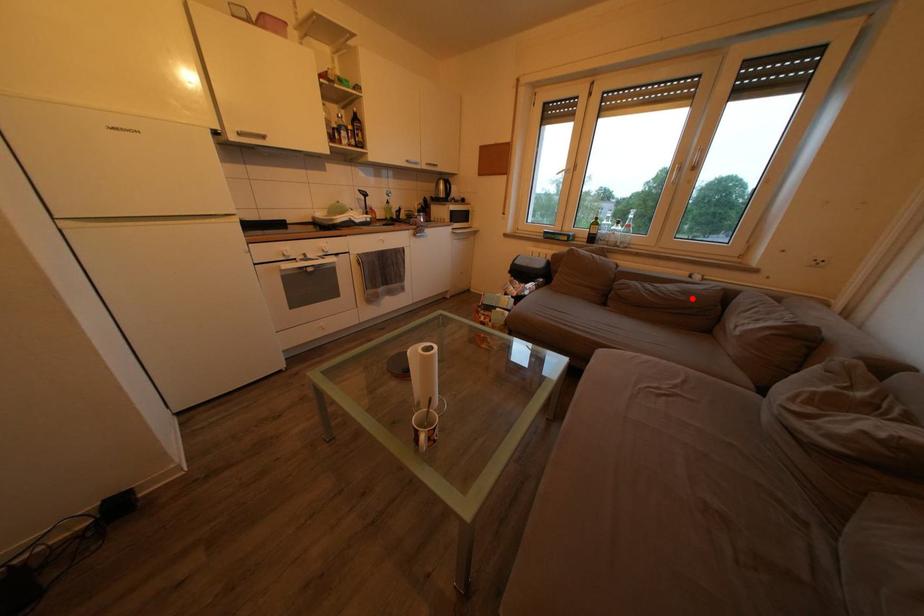
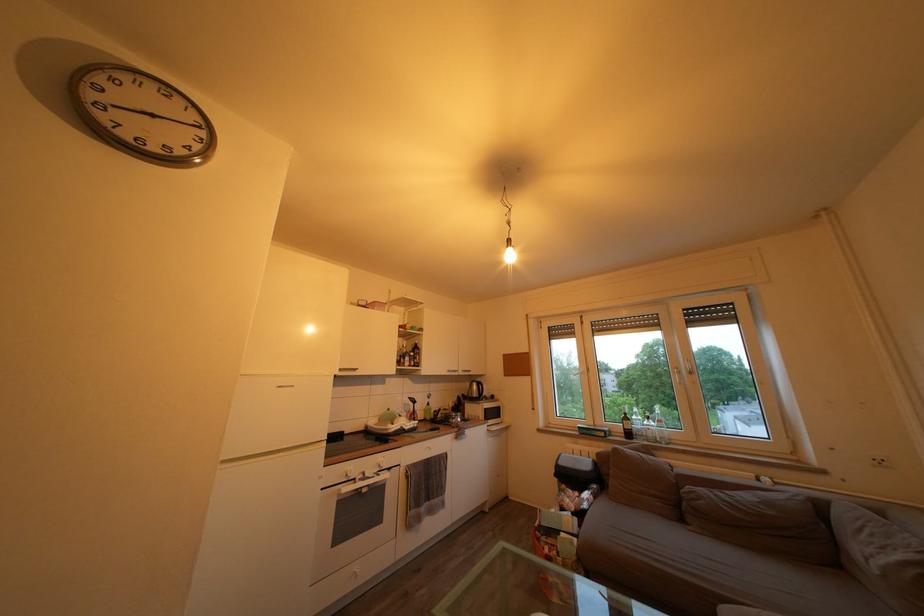
Question: I am providing you with two images of the same scene from different viewpoints. A red point is shown in image1. For the corresponding object point in image2, is it positioned nearer or farther from the camera?

Choices:
 (A) Nearer
 (B) Farther

Answer: (A)